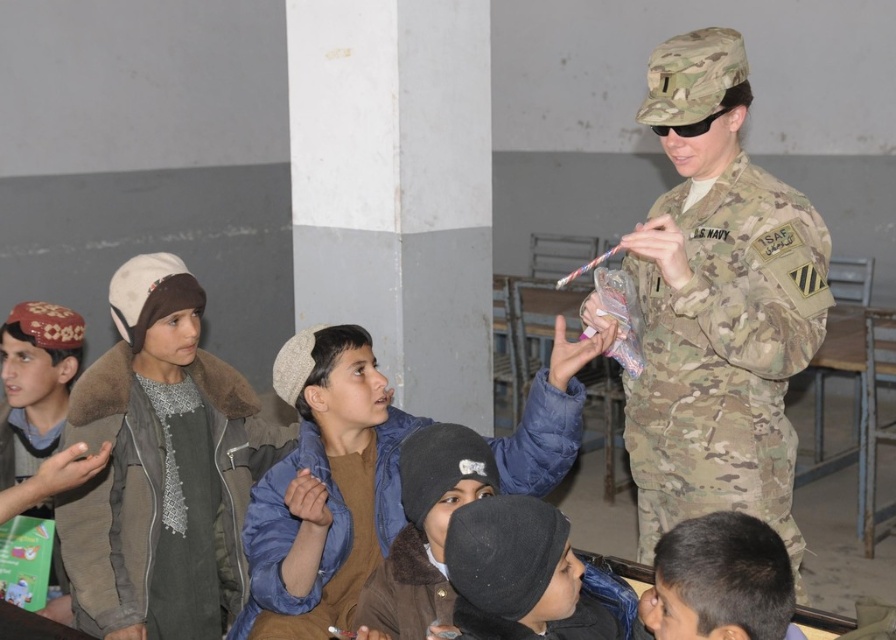
Question: Does camouflage uniform at right come in front of brown fur-lined jacket at left?

Choices:
 (A) yes
 (B) no

Answer: (A)

Question: Which object is the closest to the brown fur-lined jacket at left?

Choices:
 (A) black woolen hat at lower center
 (B) dark brown hair at lower right

Answer: (A)

Question: Which object is closer to the camera taking this photo?

Choices:
 (A) brown fur-lined jacket at left
 (B) camouflage uniform at right

Answer: (B)

Question: Does camouflage fabric uniform at center appear over dark brown hair at lower right?

Choices:
 (A) yes
 (B) no

Answer: (A)

Question: Which of the following is the farthest from the observer?

Choices:
 (A) click(332, 509)
 (B) click(705, 580)

Answer: (A)

Question: Does black woolen hat at lower center appear on the right side of camouflage fabric uniform at center?

Choices:
 (A) no
 (B) yes

Answer: (B)